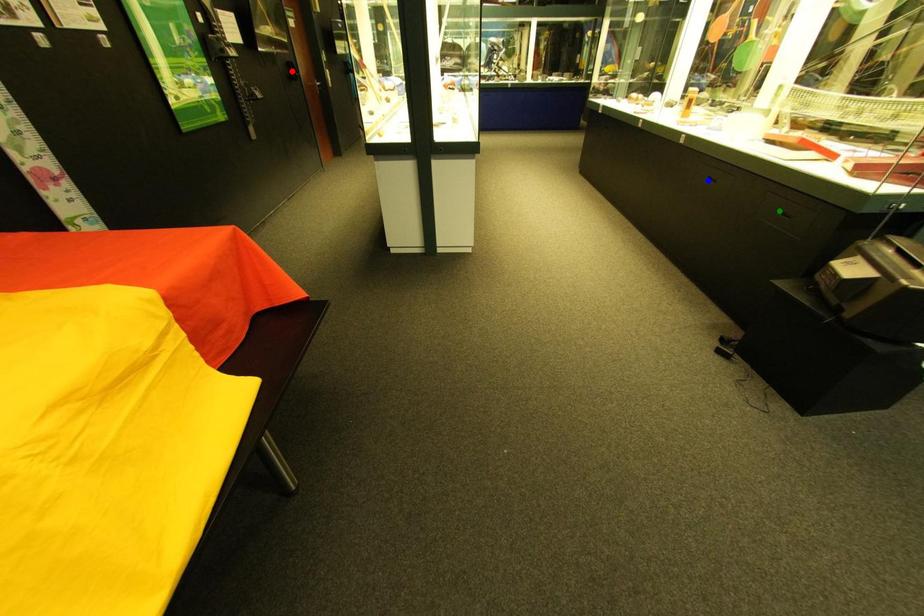
Order these from nearest to farthest:
1. blue point
2. green point
3. red point

1. green point
2. blue point
3. red point